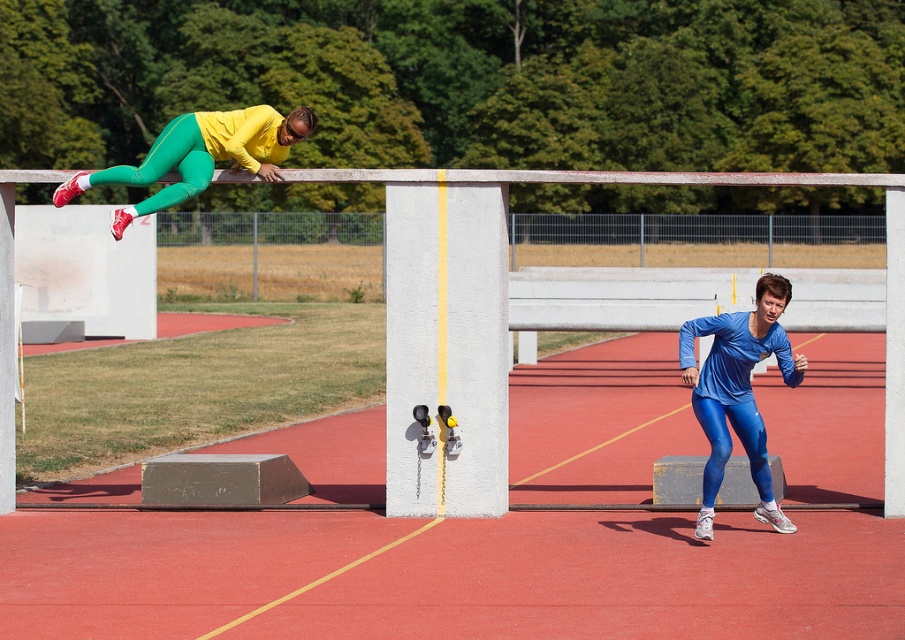
Which is below, white concrete pillar at center or matte yellow and green athletic suit at upper left?

white concrete pillar at center is lower down.

Which is in front, point (500, 445) or point (227, 125)?

Point (500, 445)

Is point (440, 483) closer to camera compared to point (187, 160)?

Yes, point (440, 483) is closer to viewer.

Locate an element on the screen. The width and height of the screenshot is (905, 640). white concrete pillar at center is located at coordinates (446, 342).

Can you confirm if white concrete pillar at center is bigger than blue shiny leggings at lower right?

Incorrect, white concrete pillar at center is not larger than blue shiny leggings at lower right.

You are a GUI agent. You are given a task and a screenshot of the screen. Output one action in this format:
    pyautogui.click(x=<x>, y=<y>)
    Task: Click on the white concrete pillar at center
    The image size is (905, 640).
    Given the screenshot: What is the action you would take?
    pyautogui.click(x=446, y=342)

Describe the element at coordinates (446, 342) in the screenshot. I see `white concrete pillar at center` at that location.

Locate an element on the screen. The width and height of the screenshot is (905, 640). white concrete pillar at center is located at coordinates (446, 342).

Which is in front, point (767, 492) or point (189, 170)?

Point (767, 492) is more forward.

From the picture: Is blue shiny leggings at lower right positioned before matte yellow and green athletic suit at upper left?

Yes, blue shiny leggings at lower right is closer to the viewer.

Does point (742, 355) lie in front of point (127, 166)?

Yes, it is in front of point (127, 166).

Where is `blue shiny leggings at lower right`? The width and height of the screenshot is (905, 640). blue shiny leggings at lower right is located at coordinates (738, 392).